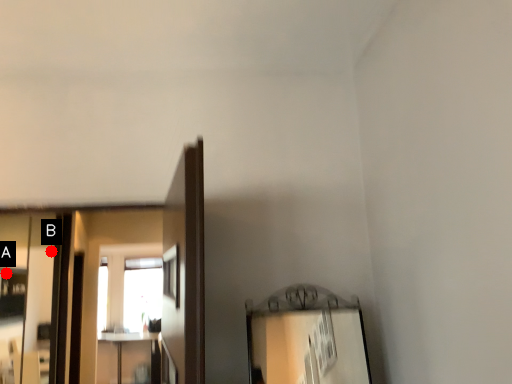
Question: Two points are circled on the image, labeled by A and B beside each circle. Which point is farther to the camera?

Choices:
 (A) A is further
 (B) B is further

Answer: (B)